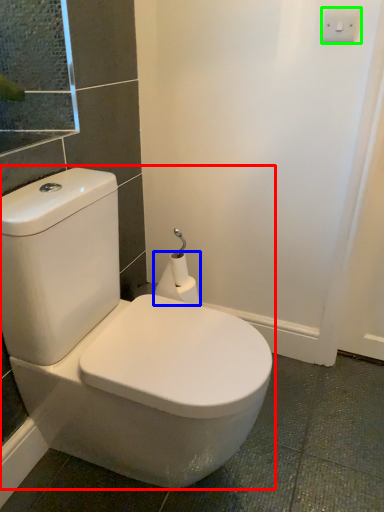
Question: Which object is positioned closest to toilet (highlighted by a red box)? Select from toilet paper (highlighted by a blue box) and light switch (highlighted by a green box).

Choices:
 (A) toilet paper
 (B) light switch

Answer: (A)